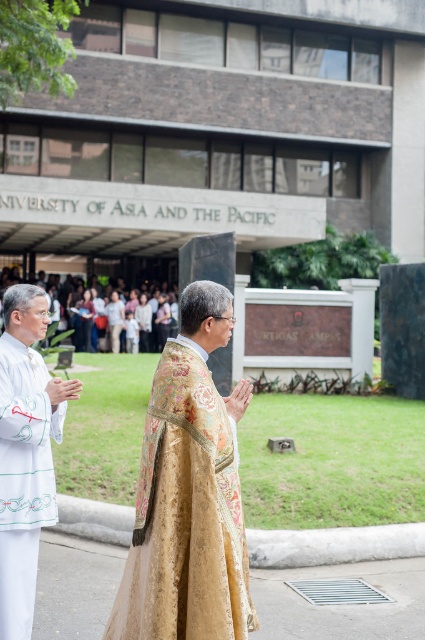
Which is more to the right, gold brocade robe at center or white silk robe at left?

gold brocade robe at center is more to the right.

Which is behind, point (203, 301) or point (27, 339)?

Point (27, 339)

Where is `gold brocade robe at center`? The width and height of the screenshot is (425, 640). gold brocade robe at center is located at coordinates (189, 493).